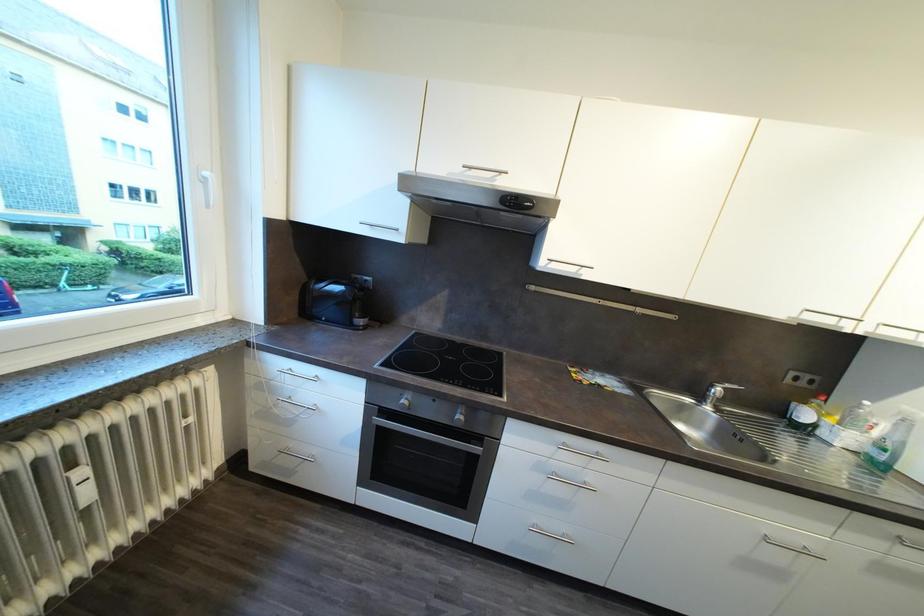
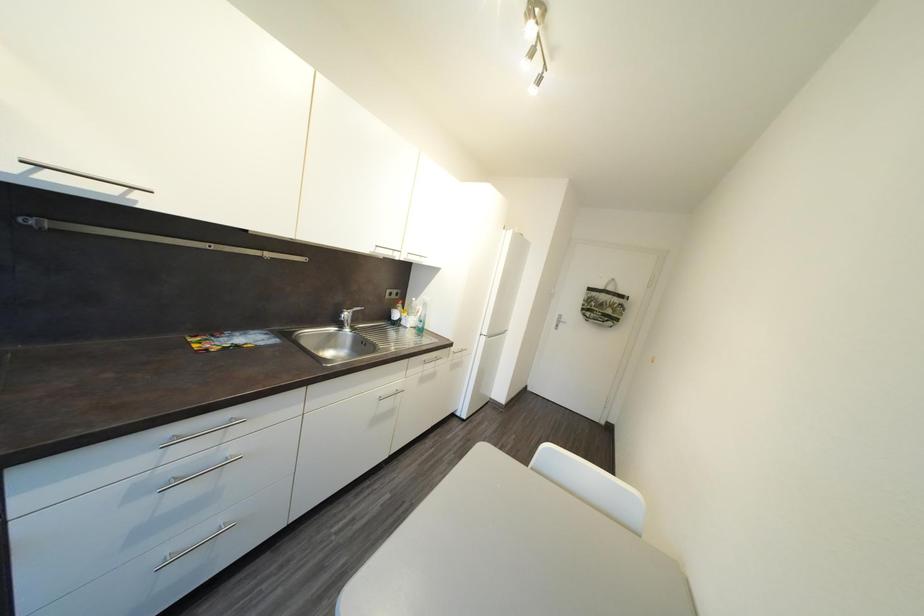
Question: The camera is either moving clockwise (left) or counter-clockwise (right) around the object. The first image is from the beginning of the video and the second image is from the end. Is the camera moving left or right when shooting the video?

Choices:
 (A) Left
 (B) Right

Answer: (A)